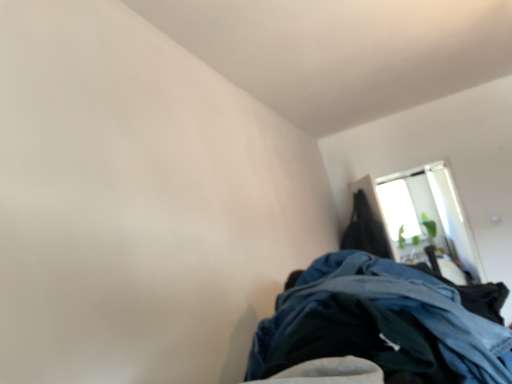
Question: In terms of width, does black matte coat at upper right look wider or thinner when compared to transparent glass window at upper right?

Choices:
 (A) wide
 (B) thin

Answer: (A)

Question: From the image's perspective, is black matte coat at upper right positioned above or below transparent glass window at upper right?

Choices:
 (A) below
 (B) above

Answer: (B)

Question: Based on their positions, is black matte coat at upper right located to the left or right of transparent glass window at upper right?

Choices:
 (A) right
 (B) left

Answer: (B)

Question: Considering the positions of point (404, 203) and point (347, 241), is point (404, 203) closer or farther from the camera than point (347, 241)?

Choices:
 (A) closer
 (B) farther

Answer: (B)

Question: From a real-world perspective, is transparent glass window at upper right above or below black matte coat at upper right?

Choices:
 (A) above
 (B) below

Answer: (B)

Question: From the image's perspective, is transparent glass window at upper right above or below black matte coat at upper right?

Choices:
 (A) above
 (B) below

Answer: (B)

Question: Based on their positions, is transparent glass window at upper right located to the left or right of black matte coat at upper right?

Choices:
 (A) right
 (B) left

Answer: (A)